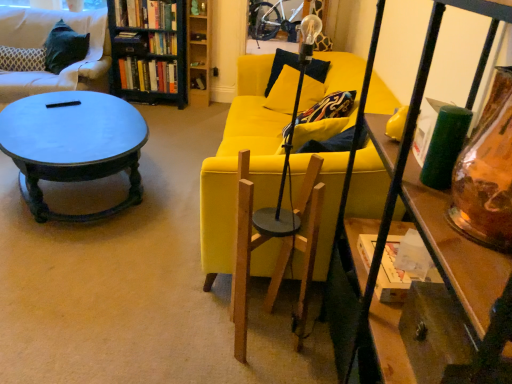
Where is `vacant area that lies in front of wooden bookshelf at center`? vacant area that lies in front of wooden bookshelf at center is located at coordinates (199, 105).